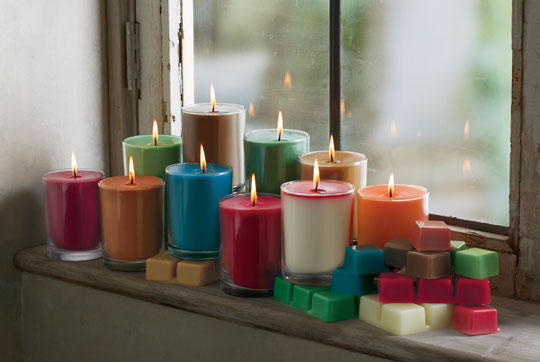
Locate an element on the screen. Image resolution: width=540 pixels, height=362 pixels. burning candles is located at coordinates (386, 215), (312, 217), (258, 228), (187, 200), (131, 209), (73, 195), (159, 151), (205, 133), (255, 149), (345, 171).